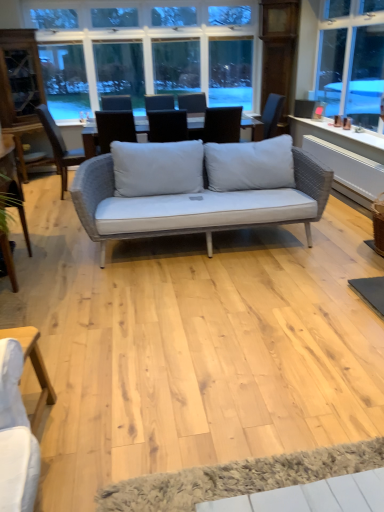
Question: Considering the positions of woven fabric chair at center, positioned as the second chair in right-to-left order, and matte gray wicker armchair at upper right in the image, is woven fabric chair at center, positioned as the second chair in right-to-left order, taller or shorter than matte gray wicker armchair at upper right?

Choices:
 (A) short
 (B) tall

Answer: (B)

Question: Considering the positions of woven fabric chair at center, which is counted as the first chair, starting from the left, and matte gray wicker armchair at upper right in the image, is woven fabric chair at center, which is counted as the first chair, starting from the left, bigger or smaller than matte gray wicker armchair at upper right?

Choices:
 (A) small
 (B) big

Answer: (B)

Question: Which object is positioned closest to the white textured yoga mat at lower center?

Choices:
 (A) matte gray cushion at center, the 2th chair viewed from the left
 (B) light wood table at lower left
 (C) matte gray wicker armchair at upper right
 (D) woven fabric chair at center, positioned as the second chair in right-to-left order
 (E) clear glass window at upper center

Answer: (B)

Question: Estimate the real-world distances between objects in this image. Which object is closer to the clear glass window at upper center?

Choices:
 (A) white textured yoga mat at lower center
 (B) matte gray wicker armchair at upper right
 (C) woven fabric chair at center, positioned as the second chair in right-to-left order
 (D) light wood table at lower left
 (E) matte gray cushion at center, arranged as the 1th chair when viewed from the right

Answer: (C)